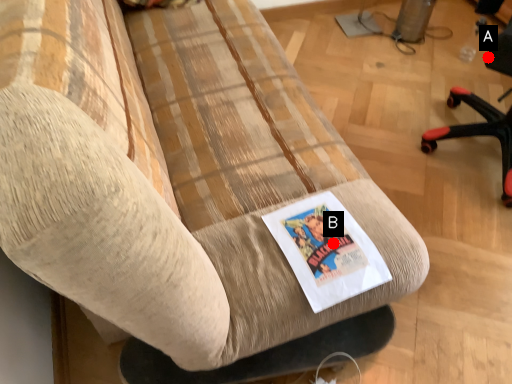
Question: Two points are circled on the image, labeled by A and B beside each circle. Among these points, which one is farthest from the camera?

Choices:
 (A) A is further
 (B) B is further

Answer: (A)